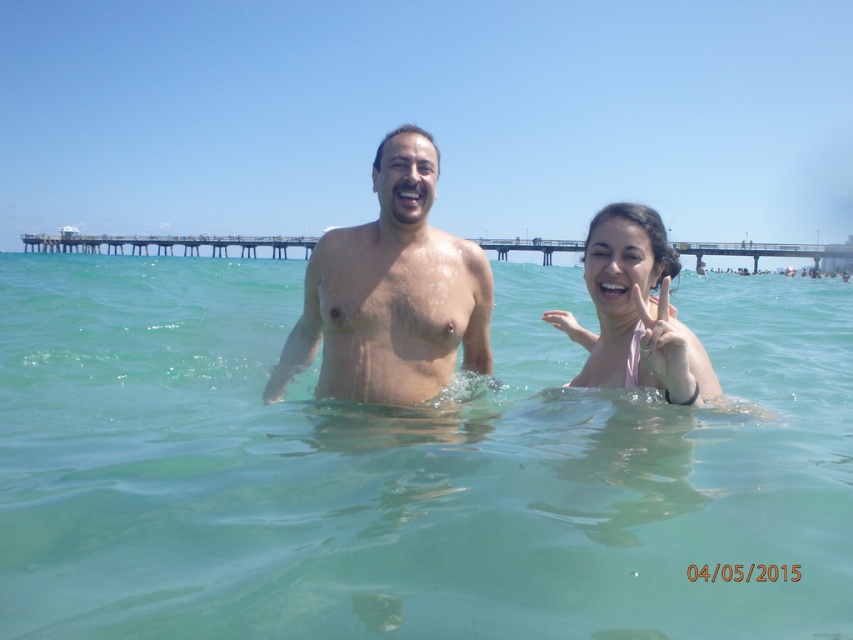
You are planning to place a 2.5 meter wide inflatable pool on the beach. You see the pink fabric at right and the wooden pier at upper center. Which location has enough space to accommodate the pool?

The wooden pier at upper center has a width greater than the pink fabric at right. Since the pink fabric at right is narrower, the wooden pier at upper center would be the better choice for placing the 2.5 meter wide inflatable pool, as it likely has sufficient space.

You are a photographer at the beach scene. You want to capture a photo of the pink fabric at right and the wooden pier at upper center. Which object is positioned lower in the image?

The pink fabric at right is located below the wooden pier at upper center, so it is positioned lower in the image.